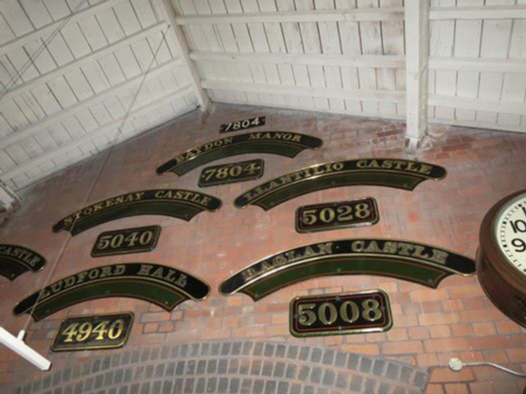
You are a GUI agent. You are given a task and a screenshot of the screen. Output one action in this format:
    pyautogui.click(x=<x>, y=<y>)
    Task: Click on the floor
    
    Given the screenshot: What is the action you would take?
    pyautogui.click(x=240, y=226)